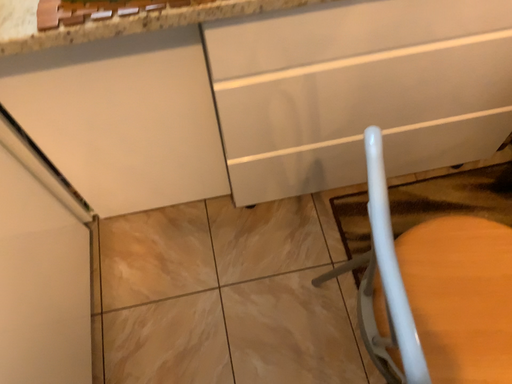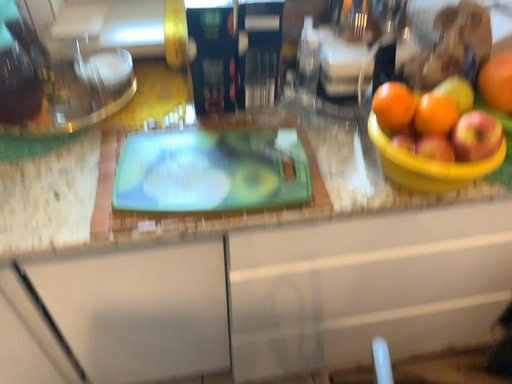
Question: How did the camera likely rotate when shooting the video?

Choices:
 (A) rotated upward
 (B) rotated downward

Answer: (A)